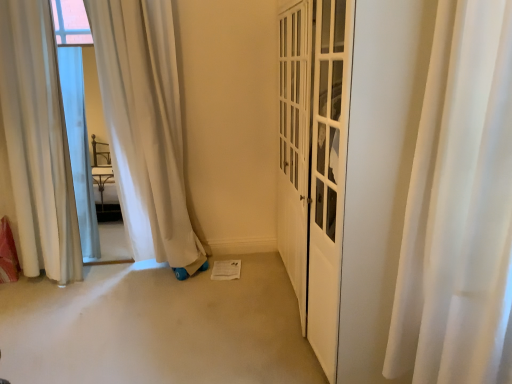
Question: Is white sheer curtain at left, acting as the 1th curtain starting from the left, at the back of white silky curtain at right, positioned as the second curtain in back-to-front order?

Choices:
 (A) no
 (B) yes

Answer: (A)

Question: Considering the relative sizes of white silky curtain at right, which is the 1th curtain from front to back, and white sheer curtain at left, arranged as the 1th curtain when viewed from the back, in the image provided, is white silky curtain at right, which is the 1th curtain from front to back, thinner than white sheer curtain at left, arranged as the 1th curtain when viewed from the back,?

Choices:
 (A) yes
 (B) no

Answer: (B)

Question: From the image's perspective, is white silky curtain at right, which is the 1th curtain from front to back, below white sheer curtain at left, placed as the second curtain when sorted from right to left?

Choices:
 (A) no
 (B) yes

Answer: (B)

Question: From a real-world perspective, is white silky curtain at right, positioned as the second curtain in back-to-front order, physically above white sheer curtain at left, acting as the 1th curtain starting from the left?

Choices:
 (A) no
 (B) yes

Answer: (A)

Question: Is white silky curtain at right, which is the 1th curtain from front to back, at the right side of white sheer curtain at left, which is counted as the second curtain, starting from the front?

Choices:
 (A) yes
 (B) no

Answer: (A)

Question: Is white silky curtain at right, marked as the 1th curtain in a right-to-left arrangement, completely or partially outside of white sheer curtain at left, arranged as the 1th curtain when viewed from the back?

Choices:
 (A) no
 (B) yes

Answer: (B)

Question: Is white sheer curtain at left, which is counted as the second curtain, starting from the front, positioned far away from white silky curtain at right, which is the 1th curtain from front to back?

Choices:
 (A) no
 (B) yes

Answer: (B)

Question: Is white silky curtain at right, marked as the second curtain in a left-to-right arrangement, inside white sheer curtain at left, acting as the 1th curtain starting from the left?

Choices:
 (A) yes
 (B) no

Answer: (B)

Question: Can you confirm if white sheer curtain at left, acting as the 1th curtain starting from the left, is wider than white silky curtain at right, positioned as the second curtain in back-to-front order?

Choices:
 (A) no
 (B) yes

Answer: (A)

Question: From a real-world perspective, is white sheer curtain at left, which is counted as the second curtain, starting from the front, under white silky curtain at right, marked as the second curtain in a left-to-right arrangement?

Choices:
 (A) yes
 (B) no

Answer: (B)

Question: Considering the relative sizes of white sheer curtain at left, which is counted as the second curtain, starting from the front, and white silky curtain at right, marked as the 1th curtain in a right-to-left arrangement, in the image provided, is white sheer curtain at left, which is counted as the second curtain, starting from the front, shorter than white silky curtain at right, marked as the 1th curtain in a right-to-left arrangement,?

Choices:
 (A) yes
 (B) no

Answer: (B)

Question: From a real-world perspective, is white sheer curtain at left, arranged as the 1th curtain when viewed from the back, over white silky curtain at right, marked as the second curtain in a left-to-right arrangement?

Choices:
 (A) no
 (B) yes

Answer: (B)

Question: Considering the positions of white sheer curtain at left, acting as the 1th curtain starting from the left, and white silky curtain at right, which is the 1th curtain from front to back, in the image, is white sheer curtain at left, acting as the 1th curtain starting from the left, bigger or smaller than white silky curtain at right, which is the 1th curtain from front to back,?

Choices:
 (A) big
 (B) small

Answer: (A)